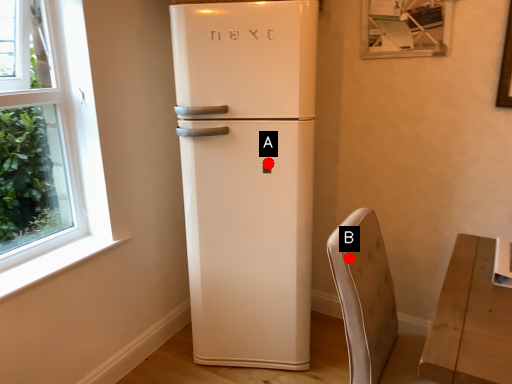
Question: Two points are circled on the image, labeled by A and B beside each circle. Which point appears farthest from the camera in this image?

Choices:
 (A) A is further
 (B) B is further

Answer: (A)